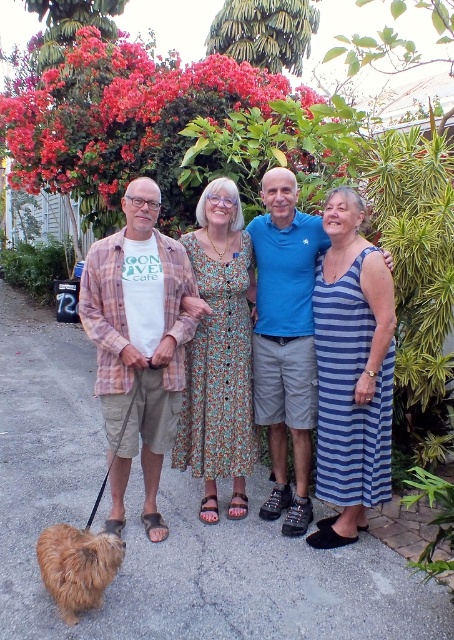
Question: Which of the following is the farthest from the observer?

Choices:
 (A) (94, 579)
 (B) (128, 461)

Answer: (B)

Question: Is matte cotton shirt at left below shaggy brown fur at lower left?

Choices:
 (A) no
 (B) yes

Answer: (A)

Question: Which of the following is the farthest from the observer?

Choices:
 (A) (132, 428)
 (B) (70, 580)

Answer: (A)

Question: Does matte cotton shirt at left lie in front of shaggy brown fur at lower left?

Choices:
 (A) no
 (B) yes

Answer: (A)

Question: Does matte cotton shirt at left have a lesser width compared to shaggy brown fur at lower left?

Choices:
 (A) yes
 (B) no

Answer: (B)